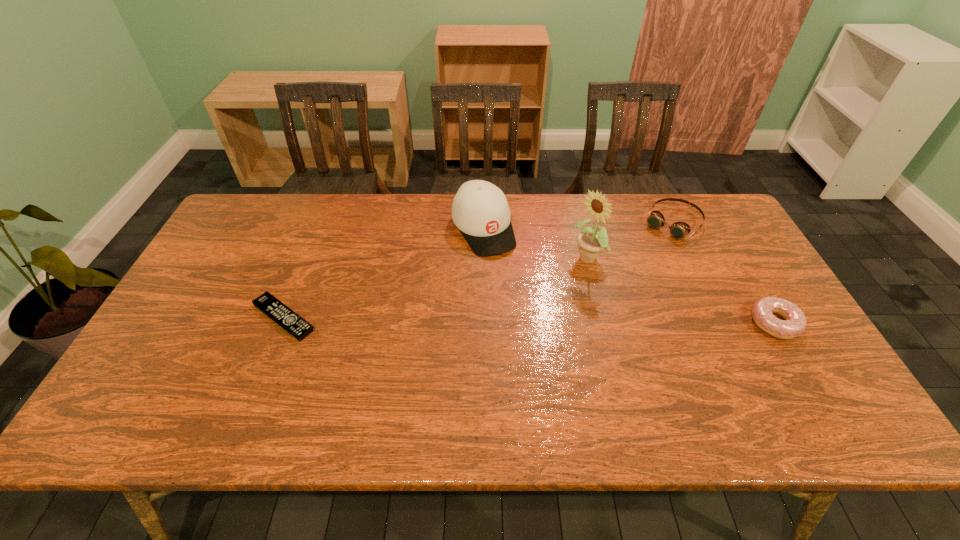
Image resolution: width=960 pixels, height=540 pixels. Find the location of `free space located 0.150m on the front-facing side of the fourth object from right to left`. free space located 0.150m on the front-facing side of the fourth object from right to left is located at coordinates 516,291.

The image size is (960, 540). What are the coordinates of `free space located 0.400m on the front-facing side of the fourth object from right to left` in the screenshot? It's located at pos(557,362).

Where is `blank space located 0.260m on the front-facing side of the fourth object from right to left`? Image resolution: width=960 pixels, height=540 pixels. blank space located 0.260m on the front-facing side of the fourth object from right to left is located at coordinates (533, 320).

This screenshot has height=540, width=960. What are the coordinates of `free region located on the front-facing side of the third object from left to right` in the screenshot? It's located at (563, 281).

Identify the location of free space located 0.370m on the front-facing side of the third object from left to right. (480, 338).

This screenshot has height=540, width=960. Find the location of `vacant space located 0.300m on the front-facing side of the third object from left to right`. vacant space located 0.300m on the front-facing side of the third object from left to right is located at coordinates (500, 324).

This screenshot has height=540, width=960. Find the location of `free region located 0.260m through the lenses of the goggles`. free region located 0.260m through the lenses of the goggles is located at coordinates (620, 283).

Locate an element on the screen. vacant area situated 0.360m through the lenses of the goggles is located at coordinates (602, 303).

At what (x,y) coordinates should I click in order to perform the action: click on vacant region located 0.200m through the lenses of the goggles. Please return your answer as a coordinate pair (x, y). Looking at the image, I should click on (630, 272).

Where is `baseball cap that is at the far edge`? This screenshot has height=540, width=960. baseball cap that is at the far edge is located at coordinates (480, 210).